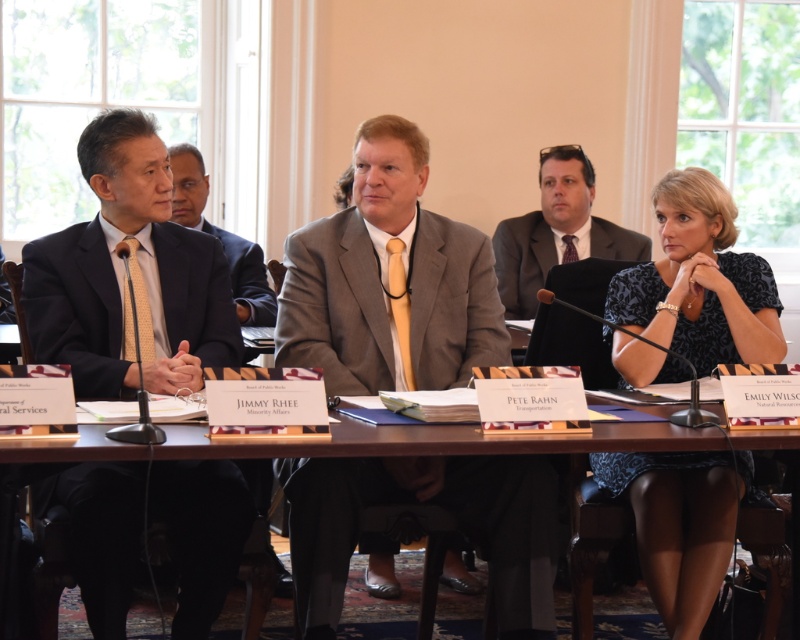
You are standing in the conference room and want to determine the relative positions of two points marked in the scene. Which point is closer to you, point (506, 352) or point (618, 256)?

Point (506, 352) is closer to the camera than point (618, 256).